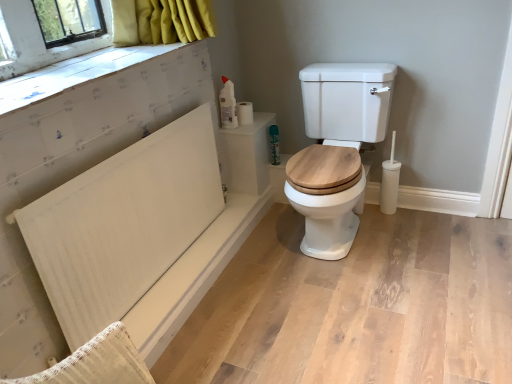
Question: Is point (240, 122) closer or farther from the camera than point (239, 119)?

Choices:
 (A) closer
 (B) farther

Answer: (B)

Question: Looking at their shapes, would you say white matte toilet paper at upper right, which ranks as the second toilet paper in left-to-right order, is wider or thinner than white matte toilet paper at upper right, arranged as the second toilet paper when viewed from the right?

Choices:
 (A) thin
 (B) wide

Answer: (B)

Question: Based on their relative distances, which object is nearer to the white textured board at upper left?

Choices:
 (A) white textured radiator at left
 (B) green matte spray can at upper right
 (C) white matte toilet paper at upper right, acting as the 1th toilet paper starting from the left
 (D) white matte bath at lower left
 (E) white matte toilet paper at upper right, the 1th toilet paper viewed from the right

Answer: (A)

Question: Which of these objects is positioned closest to the white matte toilet paper at upper right, the 1th toilet paper viewed from the right?

Choices:
 (A) white matte bath at lower left
 (B) white textured board at upper left
 (C) white wood toilet at center
 (D) white matte toilet paper at upper right, acting as the 1th toilet paper starting from the left
 (E) green matte spray can at upper right

Answer: (D)